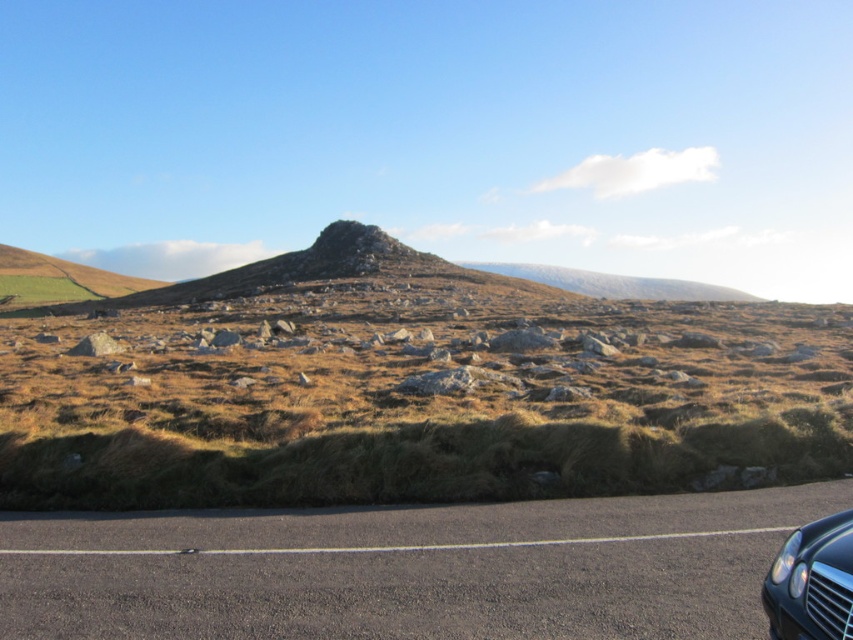
Does brown grassy hill at center appear on the right side of shiny black car at lower right?

No, brown grassy hill at center is not to the right of shiny black car at lower right.

Does brown grassy hill at center have a smaller size compared to shiny black car at lower right?

No.

Image resolution: width=853 pixels, height=640 pixels. What do you see at coordinates (410, 388) in the screenshot?
I see `brown grassy hill at center` at bounding box center [410, 388].

Where is `brown grassy hill at center`? This screenshot has height=640, width=853. brown grassy hill at center is located at coordinates (410, 388).